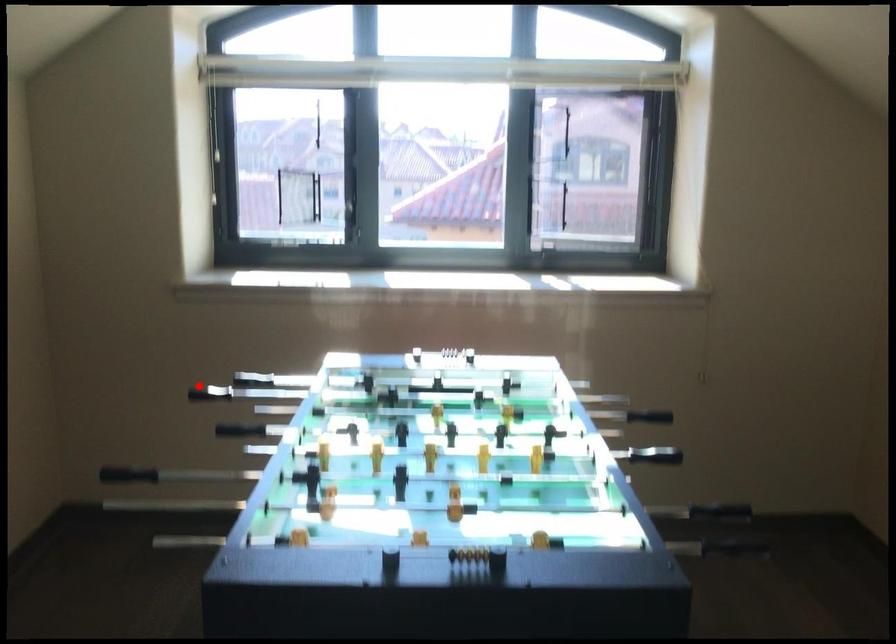
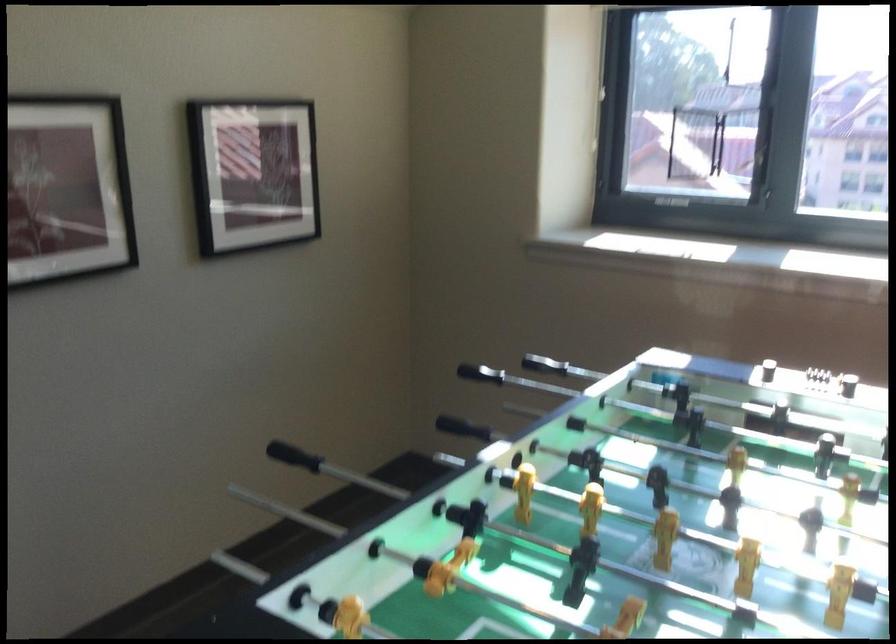
Find the pixel in the second image that matches the highlighted location in the first image.

(544, 365)